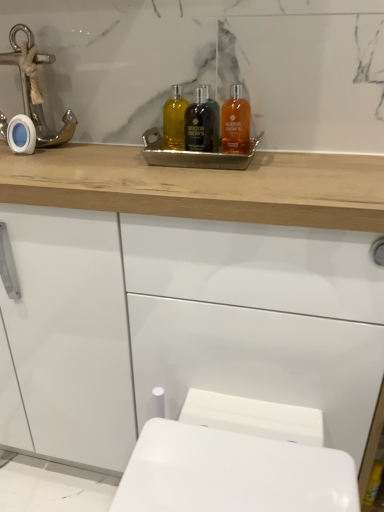
Where is `free location to the right of black glass bottle at center, arranged as the 2th mouthwash when viewed from the left`? Image resolution: width=384 pixels, height=512 pixels. free location to the right of black glass bottle at center, arranged as the 2th mouthwash when viewed from the left is located at coordinates (294, 157).